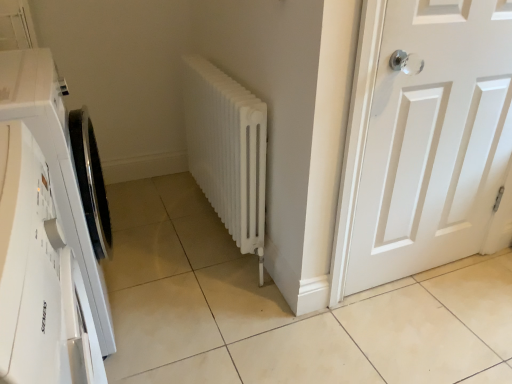
Where is `vacant space to the right of white matte door at right`? This screenshot has height=384, width=512. vacant space to the right of white matte door at right is located at coordinates (473, 283).